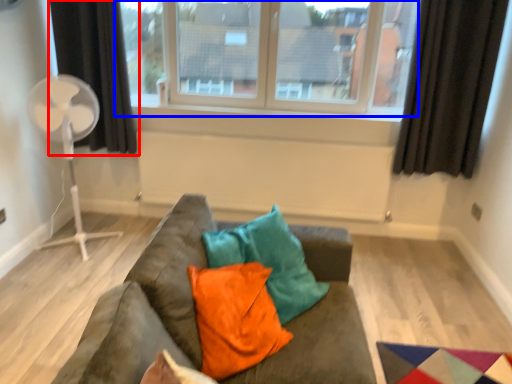
Question: Which object is closer to the camera taking this photo, curtain (highlighted by a red box) or window (highlighted by a blue box)?

Choices:
 (A) curtain
 (B) window

Answer: (B)